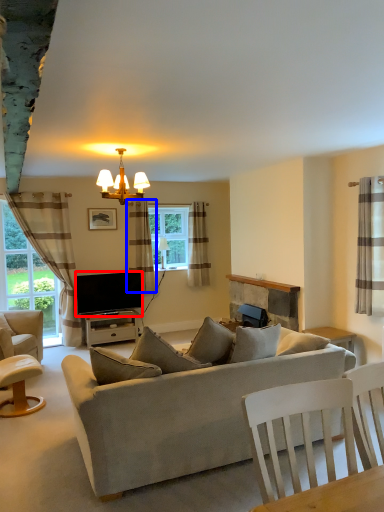
Question: Which of the following is the closest to the observer, television (highlighted by a red box) or curtain (highlighted by a blue box)?

Choices:
 (A) television
 (B) curtain

Answer: (A)